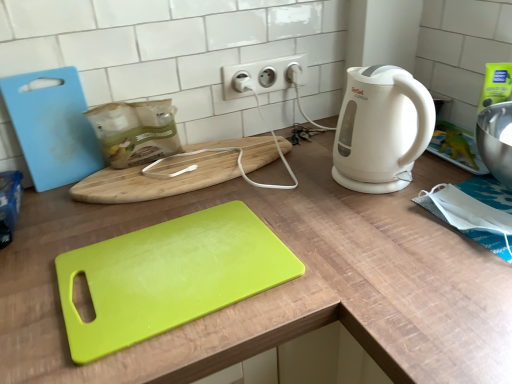
Locate an element on the screen. empty space that is ontop of lime green plastic cutting board at center, the third cutting board from the back is located at coordinates (177, 259).